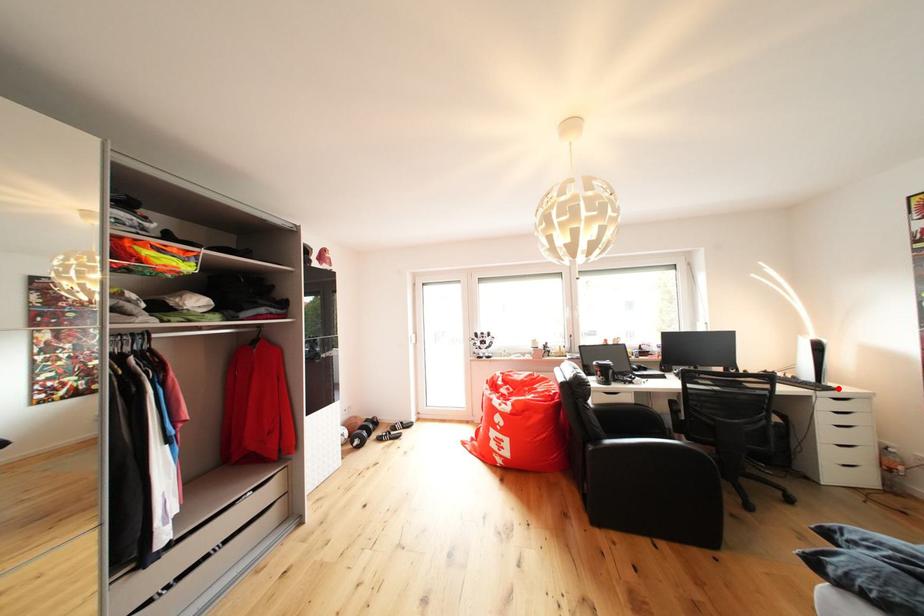
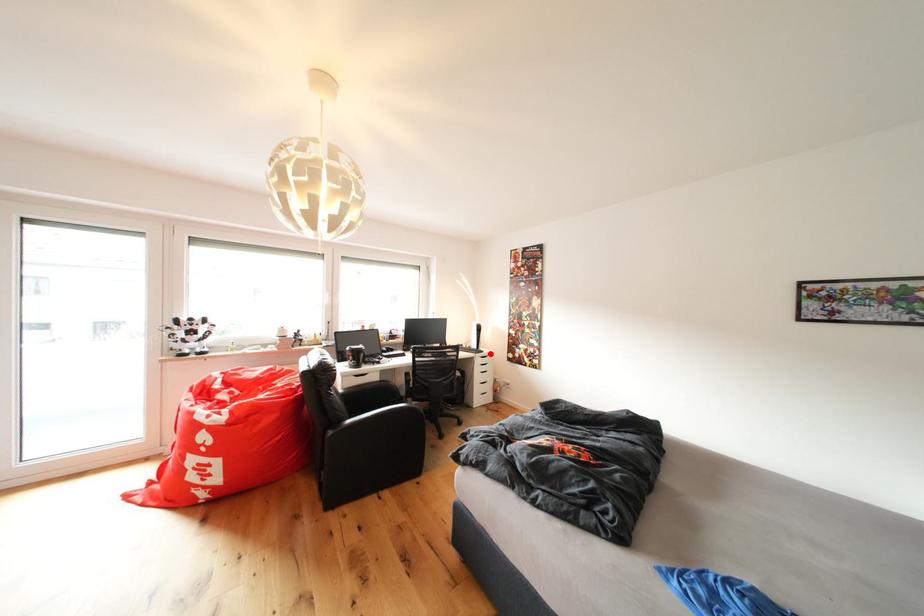
I am providing you with two images of the same scene from different viewpoints. A red point is marked on the first image and another point is marked on the second image. Is the red point in image1 aligned with the point shown in image2?

Yes